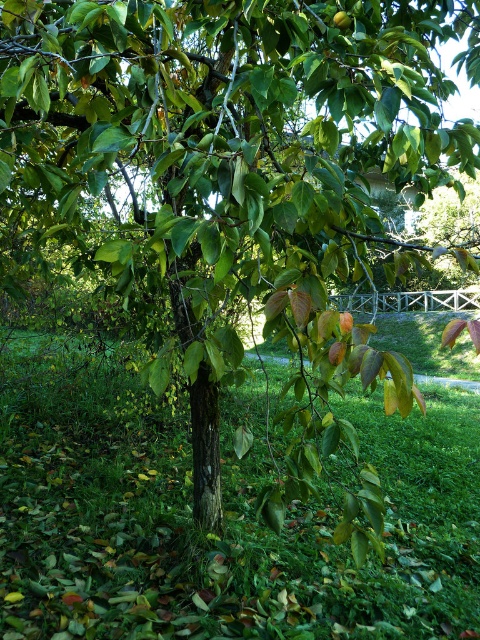
Is point (80, 452) behind point (336, 26)?

That is True.

Find the location of a particular element. This screenshot has height=640, width=480. green grassy at center is located at coordinates (224, 513).